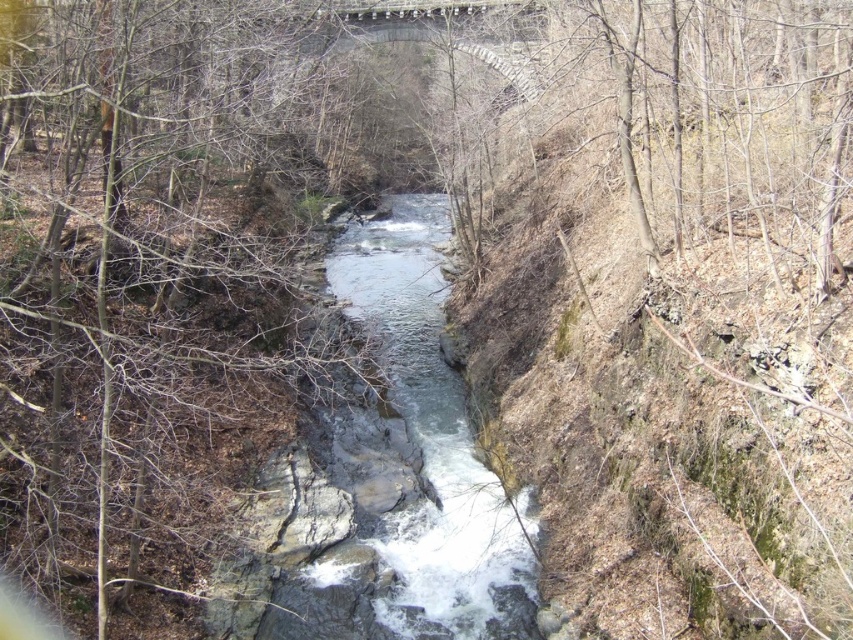
Is point (51, 16) positioned after point (474, 531)?

No, (51, 16) is closer to viewer.

You are a GUI agent. You are given a task and a screenshot of the screen. Output one action in this format:
    pyautogui.click(x=<x>, y=<y>)
    Task: Click on the brown/dry wood at left
    The image size is (853, 640).
    Given the screenshot: What is the action you would take?
    pyautogui.click(x=134, y=300)